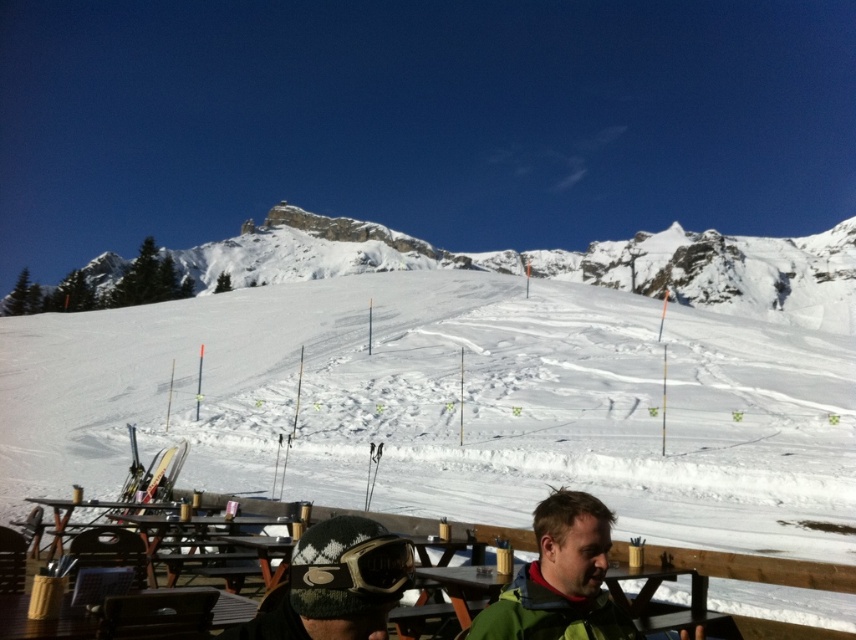
You are standing at the center of the image and want to locate the green woolen jacket at lower center. According to the coordinates provided, in which direction should you look to find it?

The green woolen jacket at lower center is located at coordinates point (562,579). Since the coordinate system is normalized, with the origin at the top left corner, the x increases to the right and y increases downward. Therefore, to locate the green woolen jacket at lower center, you should look towards the lower right direction from the center of the image.